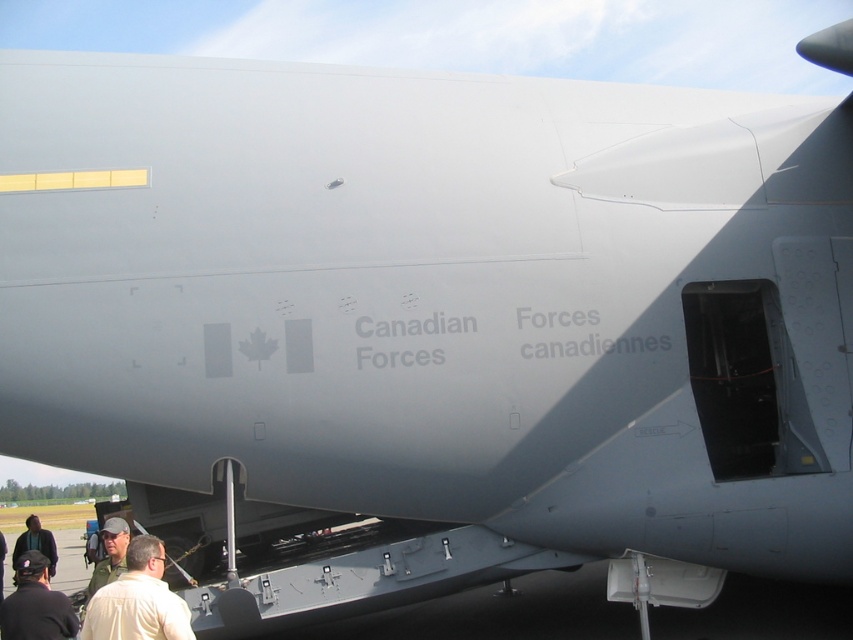
Question: Which object is farther from the camera taking this photo?

Choices:
 (A) dark green jacket at lower left
 (B) light brown leather jacket at lower left

Answer: (A)

Question: Which of the following is the farthest from the observer?

Choices:
 (A) dark gray hair at lower left
 (B) dark green jacket at lower left
 (C) light brown leather jacket at lower left
 (D) camouflage fabric cap at lower left

Answer: (A)

Question: In this image, where is camouflage fabric cap at lower left located relative to dark green jacket at lower left?

Choices:
 (A) right
 (B) left

Answer: (A)

Question: Which of the following is the closest to the observer?

Choices:
 (A) (16, 554)
 (B) (112, 579)

Answer: (B)

Question: Does light brown leather jacket at lower left appear under black fabric at lower left?

Choices:
 (A) no
 (B) yes

Answer: (A)

Question: From the image, what is the correct spatial relationship of black fabric at lower left in relation to dark green jacket at lower left?

Choices:
 (A) left
 (B) right

Answer: (B)